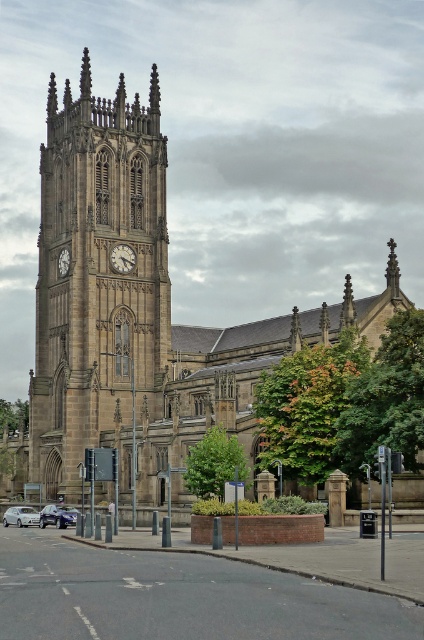
From the picture: Does brown stone church at center appear on the left side of white marble clock at center?

Incorrect, brown stone church at center is not on the left side of white marble clock at center.

Does point (91, 435) come closer to viewer compared to point (113, 259)?

Yes, it is in front of point (113, 259).

Locate an element on the screen. Image resolution: width=424 pixels, height=640 pixels. brown stone church at center is located at coordinates (136, 310).

Can you confirm if metallic silver car at lower left is taller than silver metallic sedan at lower left?

Indeed, metallic silver car at lower left has a greater height compared to silver metallic sedan at lower left.

What do you see at coordinates (58, 515) in the screenshot? The width and height of the screenshot is (424, 640). I see `metallic silver car at lower left` at bounding box center [58, 515].

Does point (56, 508) come closer to viewer compared to point (24, 513)?

That is True.

The image size is (424, 640). In order to click on metallic silver car at lower left in this screenshot , I will do click(x=58, y=515).

Between brown stone church at center and metallic silver car at lower left, which one is positioned lower?

metallic silver car at lower left is below.

Is brown stone church at center closer to the viewer compared to metallic silver car at lower left?

Yes, it is in front of metallic silver car at lower left.

What do you see at coordinates (136, 310) in the screenshot?
I see `brown stone church at center` at bounding box center [136, 310].

The image size is (424, 640). In order to click on brown stone church at center in this screenshot , I will do `click(136, 310)`.